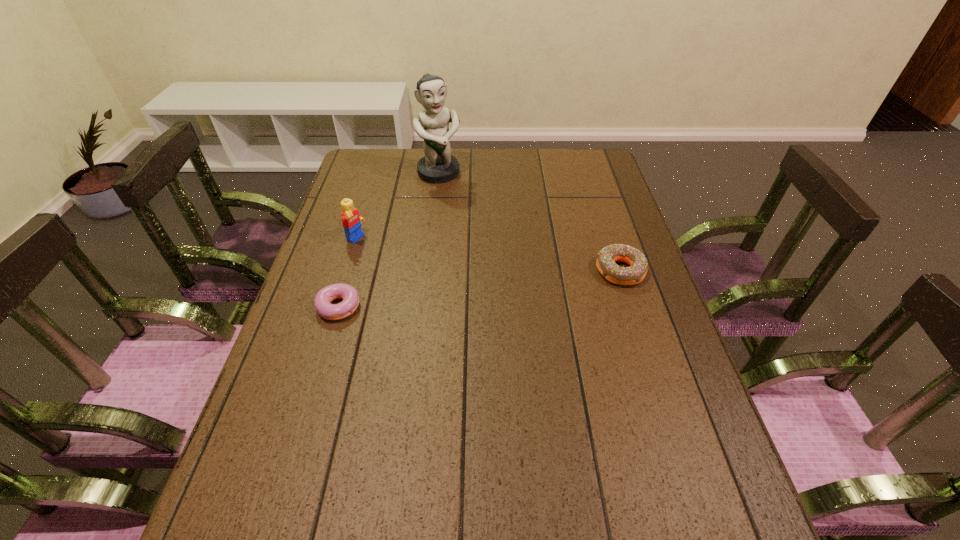
The width and height of the screenshot is (960, 540). I want to click on vacant space at the far edge, so click(541, 174).

Locate an element on the screen. The image size is (960, 540). vacant space at the near edge of the desktop is located at coordinates (537, 486).

You are a GUI agent. You are given a task and a screenshot of the screen. Output one action in this format:
    pyautogui.click(x=<x>, y=<y>)
    Task: Click on the vacant space at the left edge
    This screenshot has width=960, height=540.
    Given the screenshot: What is the action you would take?
    pyautogui.click(x=358, y=242)

In the image, there is a desktop. In order to click on free space at the right edge in this screenshot , I will do `click(601, 312)`.

Where is `vacant space at the far right corner`? Image resolution: width=960 pixels, height=540 pixels. vacant space at the far right corner is located at coordinates (578, 170).

In the image, there is a desktop. At what (x,y) coordinates should I click in order to perform the action: click on vacant space at the near right corner. Please return your answer as a coordinate pair (x, y). This screenshot has width=960, height=540. Looking at the image, I should click on (725, 484).

Locate an element on the screen. free space between the right doughnut and the shorter doughnut is located at coordinates (480, 288).

Locate an element on the screen. The image size is (960, 540). free space between the shorter doughnut and the third shortest object is located at coordinates (348, 272).

Find the location of a particular element. Image resolution: width=960 pixels, height=540 pixels. free space that is in between the rightmost object and the figurine is located at coordinates (530, 222).

Where is `free space between the left doughnut and the tallest object`? free space between the left doughnut and the tallest object is located at coordinates (389, 239).